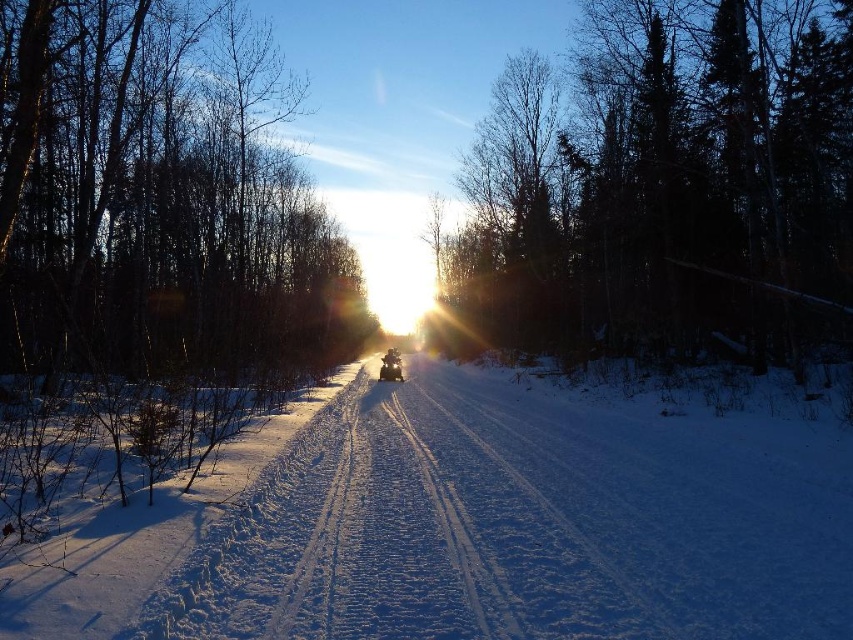
Who is higher up, white powdery snow at center or shiny silver snowmobile at center?

shiny silver snowmobile at center

Who is taller, white powdery snow at center or shiny silver snowmobile at center?

Standing taller between the two is white powdery snow at center.

Is point (187, 636) positioned behind point (380, 368)?

That is False.

What are the coordinates of `white powdery snow at center` in the screenshot? It's located at (468, 525).

Is dark green textured tree at upper center to the right of metallic silver snowmobile at center from the viewer's perspective?

Correct, you'll find dark green textured tree at upper center to the right of metallic silver snowmobile at center.

Is dark green textured tree at upper center positioned before metallic silver snowmobile at center?

Yes, dark green textured tree at upper center is in front of metallic silver snowmobile at center.

Image resolution: width=853 pixels, height=640 pixels. Find the location of `dark green textured tree at upper center`. dark green textured tree at upper center is located at coordinates (666, 189).

Locate an element on the screen. The height and width of the screenshot is (640, 853). dark green textured tree at upper center is located at coordinates (666, 189).

Which is in front, point (677, 228) or point (381, 356)?

Point (677, 228) is more forward.

Is point (697, 316) positioned before point (399, 371)?

Yes, point (697, 316) is closer to viewer.

Which is behind, point (830, 220) or point (383, 371)?

Positioned behind is point (383, 371).

Identify the location of dark green textured tree at upper center. pos(666,189).